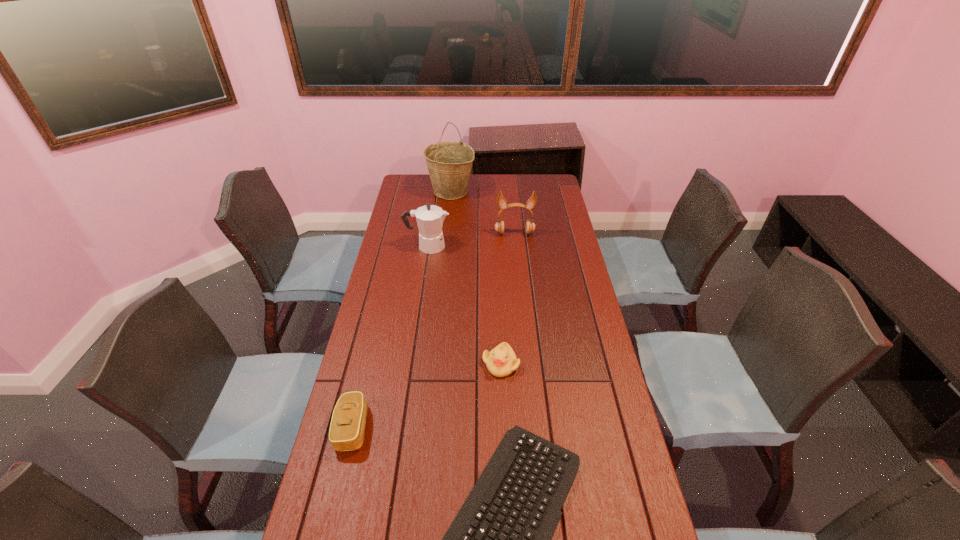
This screenshot has height=540, width=960. I want to click on free space located 0.130m on the zipper side of the clutch bag, so click(415, 428).

I want to click on object that is at the far edge, so click(449, 163).

Where is `wine bucket at the left edge`? wine bucket at the left edge is located at coordinates (449, 163).

The image size is (960, 540). I want to click on coffeepot at the left edge, so click(x=430, y=218).

The image size is (960, 540). Find the location of `clutch bag positioned at the left edge`. clutch bag positioned at the left edge is located at coordinates (347, 427).

Locate an element on the screen. object present at the right edge is located at coordinates (501, 201).

Locate an element on the screen. object positioned at the far left corner is located at coordinates (449, 163).

At what (x,y) coordinates should I click in order to perform the action: click on free region at the left edge of the desktop. Please return your answer as a coordinate pair (x, y). Looking at the image, I should click on (383, 343).

In order to click on free region at the right edge in this screenshot , I will do `click(554, 249)`.

The width and height of the screenshot is (960, 540). What are the coordinates of `vacant space at the far left corner of the desktop` in the screenshot? It's located at (429, 197).